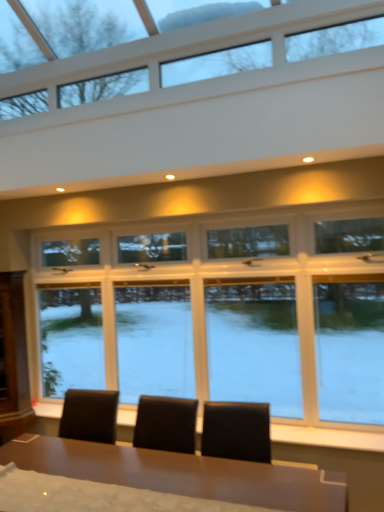
Locate an element on the screen. The image size is (384, 512). clear glass window at upper center, the second window in the bottom-to-top sequence is located at coordinates (207, 50).

What do you see at coordinates (223, 312) in the screenshot? Image resolution: width=384 pixels, height=512 pixels. I see `clear glass window at center, which appears as the 2th window when viewed from the top` at bounding box center [223, 312].

This screenshot has height=512, width=384. Find the location of `shiny brown table at center`. shiny brown table at center is located at coordinates (182, 473).

Does clear glass window at center, which appears as the 2th window when viewed from the top, have a lesser width compared to clear glass window at upper center, the second window in the bottom-to-top sequence?

Indeed, clear glass window at center, which appears as the 2th window when viewed from the top, has a lesser width compared to clear glass window at upper center, the second window in the bottom-to-top sequence.

Is clear glass window at center, which is the first window from bottom to top, positioned with its back to clear glass window at upper center, the second window in the bottom-to-top sequence?

No.

Is clear glass window at center, which is the first window from bottom to top, smaller than clear glass window at upper center, the second window in the bottom-to-top sequence?

Actually, clear glass window at center, which is the first window from bottom to top, might be larger than clear glass window at upper center, the second window in the bottom-to-top sequence.

Can you confirm if clear glass window at center, which appears as the 2th window when viewed from the top, is taller than clear glass window at upper center, the second window in the bottom-to-top sequence?

Yes, clear glass window at center, which appears as the 2th window when viewed from the top, is taller than clear glass window at upper center, the second window in the bottom-to-top sequence.

Considering the relative positions of clear glass window at upper center, positioned as the first window in top-to-bottom order, and shiny brown table at center in the image provided, is clear glass window at upper center, positioned as the first window in top-to-bottom order, behind shiny brown table at center?

That is False.

Is clear glass window at upper center, the second window in the bottom-to-top sequence, bigger than shiny brown table at center?

Actually, clear glass window at upper center, the second window in the bottom-to-top sequence, might be smaller than shiny brown table at center.

Is clear glass window at upper center, positioned as the first window in top-to-bottom order, looking in the opposite direction of shiny brown table at center?

No, clear glass window at upper center, positioned as the first window in top-to-bottom order, is not facing the opposite direction of shiny brown table at center.

Considering the relative positions of clear glass window at upper center, the second window in the bottom-to-top sequence, and clear glass window at center, which is the first window from bottom to top, in the image provided, is clear glass window at upper center, the second window in the bottom-to-top sequence, in front of clear glass window at center, which is the first window from bottom to top,?

Yes, clear glass window at upper center, the second window in the bottom-to-top sequence, is closer to the viewer.

From the image's perspective, between clear glass window at upper center, the second window in the bottom-to-top sequence, and clear glass window at center, which appears as the 2th window when viewed from the top, who is located below?

clear glass window at center, which appears as the 2th window when viewed from the top, is shown below in the image.

From a real-world perspective, is clear glass window at upper center, the second window in the bottom-to-top sequence, physically below clear glass window at center, which appears as the 2th window when viewed from the top?

No, from a real-world perspective, clear glass window at upper center, the second window in the bottom-to-top sequence, is not beneath clear glass window at center, which appears as the 2th window when viewed from the top.

This screenshot has width=384, height=512. What are the coordinates of `window behind the clear glass window at upper center, the second window in the bottom-to-top sequence` in the screenshot? It's located at (223, 312).

Is clear glass window at center, which appears as the 2th window when viewed from the top, thinner than shiny brown table at center?

Yes.

Consider the image. Does clear glass window at center, which appears as the 2th window when viewed from the top, appear on the left side of shiny brown table at center?

Incorrect, clear glass window at center, which appears as the 2th window when viewed from the top, is not on the left side of shiny brown table at center.

Is clear glass window at center, which is the first window from bottom to top, with shiny brown table at center?

No, clear glass window at center, which is the first window from bottom to top, is not with shiny brown table at center.

From the image's perspective, is clear glass window at center, which is the first window from bottom to top, above shiny brown table at center?

Indeed, from the image's perspective, clear glass window at center, which is the first window from bottom to top, is shown above shiny brown table at center.

Between shiny brown table at center and clear glass window at center, which appears as the 2th window when viewed from the top, which one has larger size?

Bigger between the two is shiny brown table at center.

Is shiny brown table at center positioned behind clear glass window at center, which is the first window from bottom to top?

No, it is in front of clear glass window at center, which is the first window from bottom to top.

Which is more to the right, shiny brown table at center or clear glass window at center, which appears as the 2th window when viewed from the top?

From the viewer's perspective, clear glass window at center, which appears as the 2th window when viewed from the top, appears more on the right side.

Can you confirm if shiny brown table at center is shorter than clear glass window at center, which appears as the 2th window when viewed from the top?

Correct, shiny brown table at center is not as tall as clear glass window at center, which appears as the 2th window when viewed from the top.

Who is shorter, shiny brown table at center or clear glass window at upper center, the second window in the bottom-to-top sequence?

clear glass window at upper center, the second window in the bottom-to-top sequence.

Is shiny brown table at center with clear glass window at upper center, positioned as the first window in top-to-bottom order?

No.

In the image, is shiny brown table at center positioned in front of or behind clear glass window at upper center, positioned as the first window in top-to-bottom order?

shiny brown table at center is positioned farther from the viewer than clear glass window at upper center, positioned as the first window in top-to-bottom order.

From the image's perspective, is shiny brown table at center located beneath clear glass window at upper center, the second window in the bottom-to-top sequence?

Indeed, from the image's perspective, shiny brown table at center is shown beneath clear glass window at upper center, the second window in the bottom-to-top sequence.

Identify the location of window on the left side of clear glass window at center, which is the first window from bottom to top. The image size is (384, 512). (207, 50).

Locate an element on the screen. The width and height of the screenshot is (384, 512). the 2nd window directly above the shiny brown table at center (from a real-world perspective) is located at coordinates (207, 50).

Considering their positions, is clear glass window at upper center, the second window in the bottom-to-top sequence, positioned further to shiny brown table at center than clear glass window at center, which appears as the 2th window when viewed from the top?

Based on the image, clear glass window at upper center, the second window in the bottom-to-top sequence, appears to be further to shiny brown table at center.

Which object lies nearer to the anchor point clear glass window at upper center, the second window in the bottom-to-top sequence, shiny brown table at center or clear glass window at center, which appears as the 2th window when viewed from the top?

clear glass window at center, which appears as the 2th window when viewed from the top, is positioned closer to the anchor clear glass window at upper center, the second window in the bottom-to-top sequence.

Considering their positions, is clear glass window at upper center, positioned as the first window in top-to-bottom order, positioned further to clear glass window at center, which is the first window from bottom to top, than shiny brown table at center?

Among the two, clear glass window at upper center, positioned as the first window in top-to-bottom order, is located further to clear glass window at center, which is the first window from bottom to top.

Which object lies further to the anchor point clear glass window at upper center, the second window in the bottom-to-top sequence, clear glass window at center, which appears as the 2th window when viewed from the top, or shiny brown table at center?

shiny brown table at center.

Considering their positions, is shiny brown table at center positioned closer to clear glass window at center, which appears as the 2th window when viewed from the top, than clear glass window at upper center, positioned as the first window in top-to-bottom order?

shiny brown table at center is closer to clear glass window at center, which appears as the 2th window when viewed from the top.

Looking at the image, which one is located further to shiny brown table at center, clear glass window at center, which appears as the 2th window when viewed from the top, or clear glass window at upper center, positioned as the first window in top-to-bottom order?

Among the two, clear glass window at upper center, positioned as the first window in top-to-bottom order, is located further to shiny brown table at center.

Where is `table located between clear glass window at upper center, positioned as the first window in top-to-bottom order, and clear glass window at center, which is the first window from bottom to top, in the depth direction`? table located between clear glass window at upper center, positioned as the first window in top-to-bottom order, and clear glass window at center, which is the first window from bottom to top, in the depth direction is located at coordinates (182, 473).